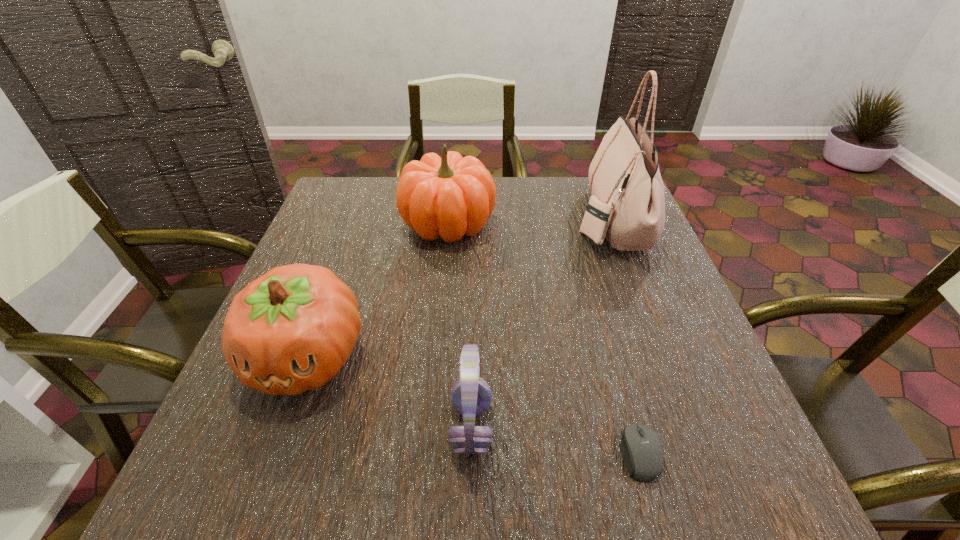
Image resolution: width=960 pixels, height=540 pixels. What are the coordinates of `the tallest object` in the screenshot? It's located at (627, 205).

Locate an element on the screen. the right pumpkin is located at coordinates pyautogui.click(x=449, y=196).

Locate an element on the screen. the nearer pumpkin is located at coordinates (291, 330).

Where is `the left pumpkin`? the left pumpkin is located at coordinates (291, 330).

You are a GUI agent. You are given a task and a screenshot of the screen. Output one action in this format:
    pyautogui.click(x=<x>, y=<y>)
    Task: Click on the fourth tallest object
    
    Given the screenshot: What is the action you would take?
    pyautogui.click(x=471, y=396)

Where is `computer equipment`? This screenshot has width=960, height=540. computer equipment is located at coordinates (642, 452).

This screenshot has width=960, height=540. What are the coordinates of `vacant space situated 0.120m on the side of the handbag with the attached pouch` in the screenshot? It's located at (532, 220).

What are the coordinates of `vacant space located on the side of the handbag with the attached pouch` in the screenshot? It's located at (535, 220).

Locate an element on the screen. vacant space located 0.200m on the side of the handbag with the attached pouch is located at coordinates (502, 220).

Locate an element on the screen. The height and width of the screenshot is (540, 960). vacant point located 0.220m on the right of the farther pumpkin is located at coordinates (578, 224).